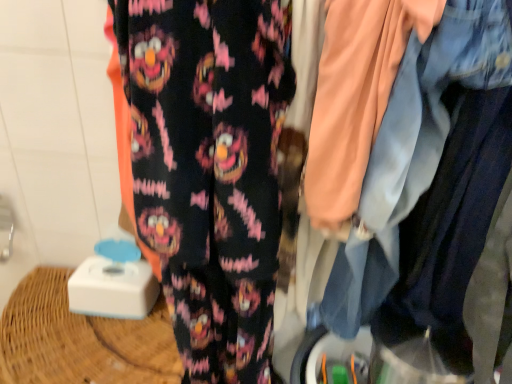
Question: Can you see faded denim jacket at upper right touching fluffy black pants at center?

Choices:
 (A) no
 (B) yes

Answer: (A)

Question: Does faded denim jacket at upper right appear on the right side of fluffy black pants at center?

Choices:
 (A) yes
 (B) no

Answer: (A)

Question: Could you tell me if faded denim jacket at upper right is facing fluffy black pants at center?

Choices:
 (A) no
 (B) yes

Answer: (A)

Question: Considering the relative sizes of faded denim jacket at upper right and fluffy black pants at center in the image provided, is faded denim jacket at upper right shorter than fluffy black pants at center?

Choices:
 (A) yes
 (B) no

Answer: (A)

Question: Is faded denim jacket at upper right oriented away from fluffy black pants at center?

Choices:
 (A) no
 (B) yes

Answer: (A)

Question: From the image's perspective, would you say faded denim jacket at upper right is positioned over fluffy black pants at center?

Choices:
 (A) yes
 (B) no

Answer: (A)

Question: Is fluffy black pants at center oriented towards faded denim jacket at upper right?

Choices:
 (A) yes
 (B) no

Answer: (B)

Question: Is fluffy black pants at center next to faded denim jacket at upper right?

Choices:
 (A) yes
 (B) no

Answer: (B)

Question: Does fluffy black pants at center come behind faded denim jacket at upper right?

Choices:
 (A) no
 (B) yes

Answer: (B)

Question: From the image's perspective, is fluffy black pants at center under faded denim jacket at upper right?

Choices:
 (A) yes
 (B) no

Answer: (A)

Question: Can you confirm if fluffy black pants at center is shorter than faded denim jacket at upper right?

Choices:
 (A) yes
 (B) no

Answer: (B)

Question: Is fluffy black pants at center to the left of faded denim jacket at upper right from the viewer's perspective?

Choices:
 (A) yes
 (B) no

Answer: (A)

Question: Looking at their shapes, would you say fluffy black pants at center is wider or thinner than faded denim jacket at upper right?

Choices:
 (A) thin
 (B) wide

Answer: (A)